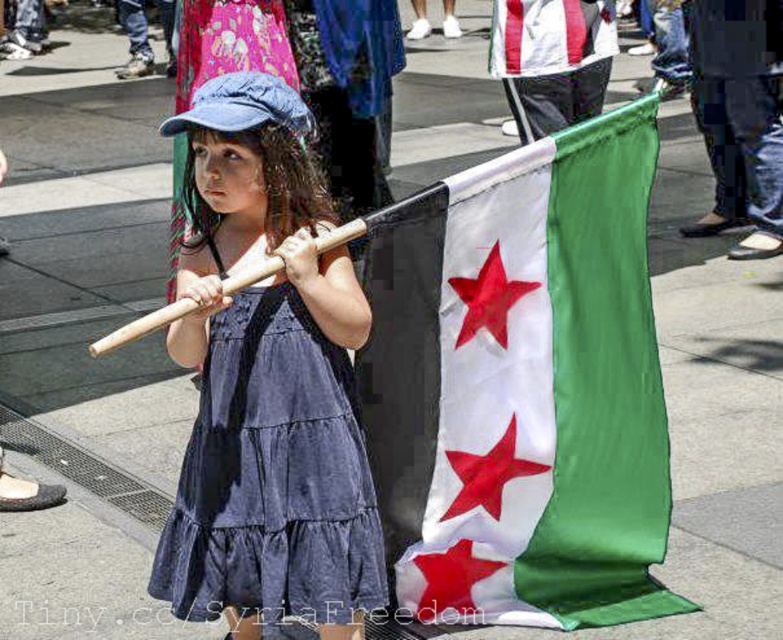
Can you confirm if silky fabric flag at center is positioned to the right of denim dress at center?

Yes, silky fabric flag at center is to the right of denim dress at center.

Where is `silky fabric flag at center`? The height and width of the screenshot is (640, 783). silky fabric flag at center is located at coordinates (522, 387).